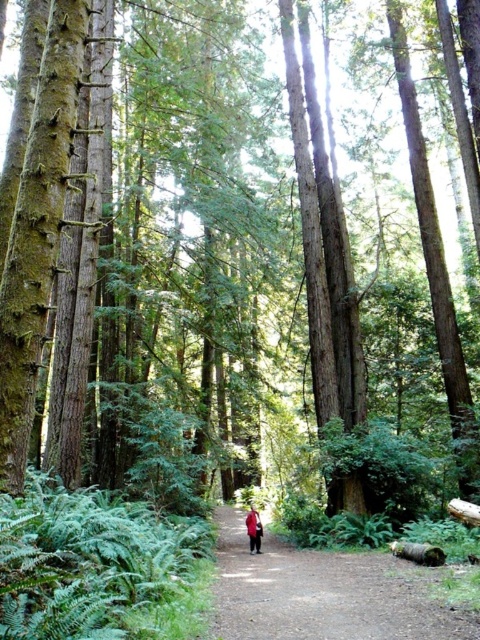
Between point (363, 627) and point (251, 508), which one is positioned in front?

Point (363, 627) is in front.

Who is positioned more to the left, dirt path at center or red fabric coat at center?

Positioned to the left is red fabric coat at center.

Which is behind, point (241, 557) or point (254, 509)?

The point (254, 509) is more distant.

This screenshot has height=640, width=480. I want to click on dirt path at center, so click(324, 593).